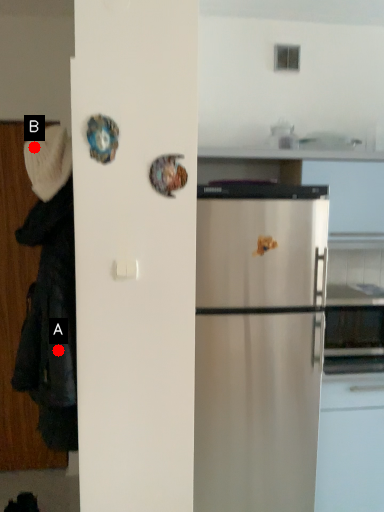
Question: Two points are circled on the image, labeled by A and B beside each circle. Which of the following is the closest to the observer?

Choices:
 (A) A is closer
 (B) B is closer

Answer: (A)